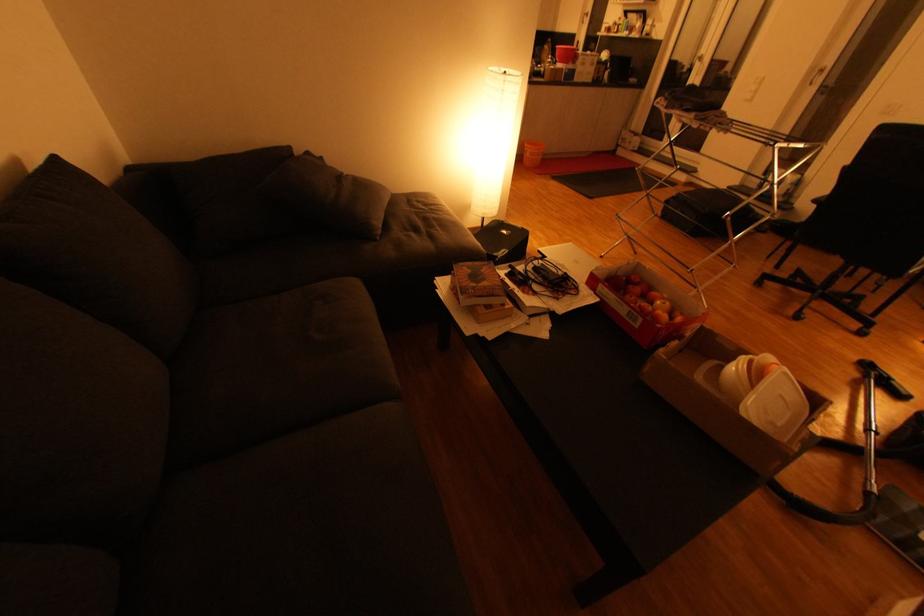
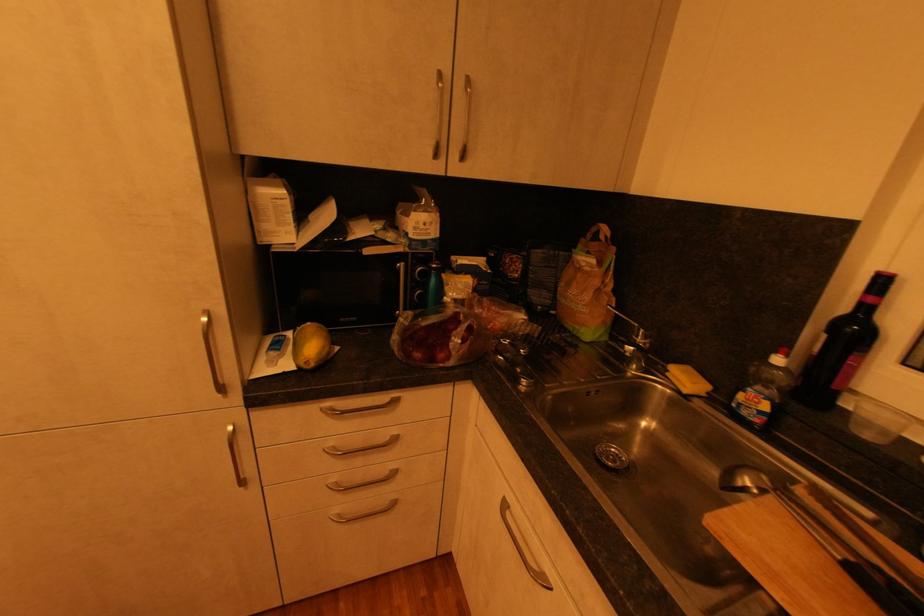
Locate, in the second image, the point that corresponds to (582,43) in the first image.

(889, 282)